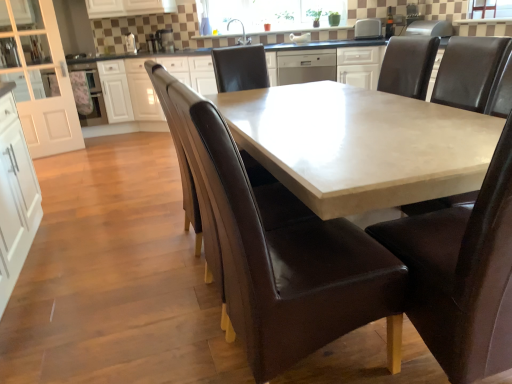
The height and width of the screenshot is (384, 512). Find the location of `free space in front of metallic stainless steel toaster at upper center, the 3th appliance from the back`. free space in front of metallic stainless steel toaster at upper center, the 3th appliance from the back is located at coordinates (127, 57).